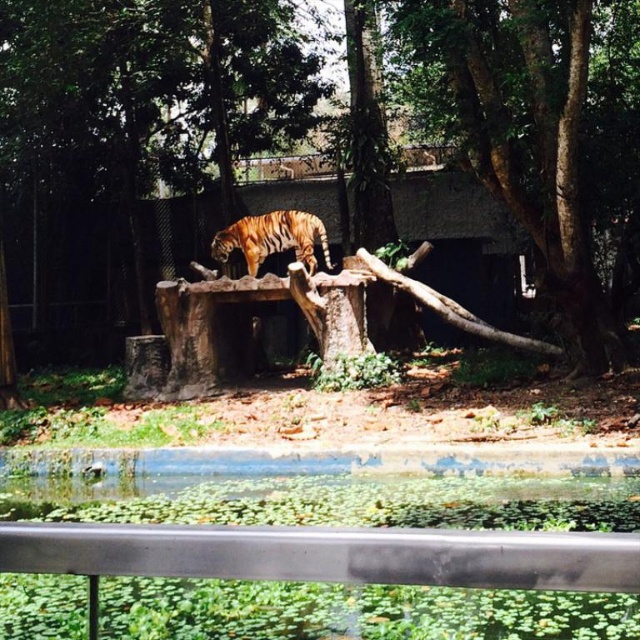
Question: Which object is farther from the camera taking this photo?

Choices:
 (A) orange striped tiger at center
 (B) brown rough tree stump at center
 (C) silver metallic rail at lower center
 (D) brown rough tree trunk at center

Answer: (A)

Question: Does brown rough tree stump at center have a greater width compared to brown rough tree trunk at center?

Choices:
 (A) no
 (B) yes

Answer: (B)

Question: Which of the following is the farthest from the observer?

Choices:
 (A) silver metallic rail at lower center
 (B) brown rough tree trunk at center
 (C) orange striped tiger at center

Answer: (C)

Question: Does brown rough tree trunk at center have a greater width compared to orange striped tiger at center?

Choices:
 (A) no
 (B) yes

Answer: (B)

Question: Which point is farther to the camera?

Choices:
 (A) (593, 124)
 (B) (106, 524)
 (C) (221, 237)

Answer: (C)

Question: Does brown rough tree trunk at center appear over silver metallic rail at lower center?

Choices:
 (A) no
 (B) yes

Answer: (B)